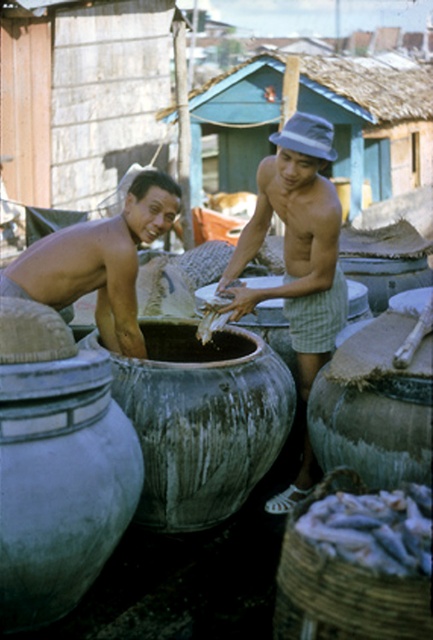
Consider the image. You are a worker in the market and need to retrieve an item from the matte gray hat at center without disturbing the silvery fish at lower right. Which direction should you move to reach the hat first?

The matte gray hat at center is above the silvery fish at lower right, so you should move upward to reach the matte gray hat at center first without disturbing the silvery fish at lower right.

You are a health inspector visiting this facility. You notice the smooth skin torso at left and the silvery fish at lower right. Which object is taller?

The smooth skin torso at left is taller than the silvery fish at lower right according to the description.

You are standing at the center of the market scene. You see a matte gray hat at center. Is there an object located at point (297, 243)?

Yes, at point (297, 243) lies the matte gray hat at center.